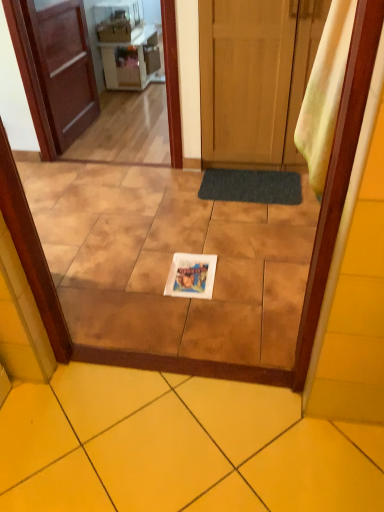
Find the location of a particular element. Image resolution: width=384 pixels, height=512 pixels. free spot below white glossy book at center (from a real-world perspective) is located at coordinates (189, 278).